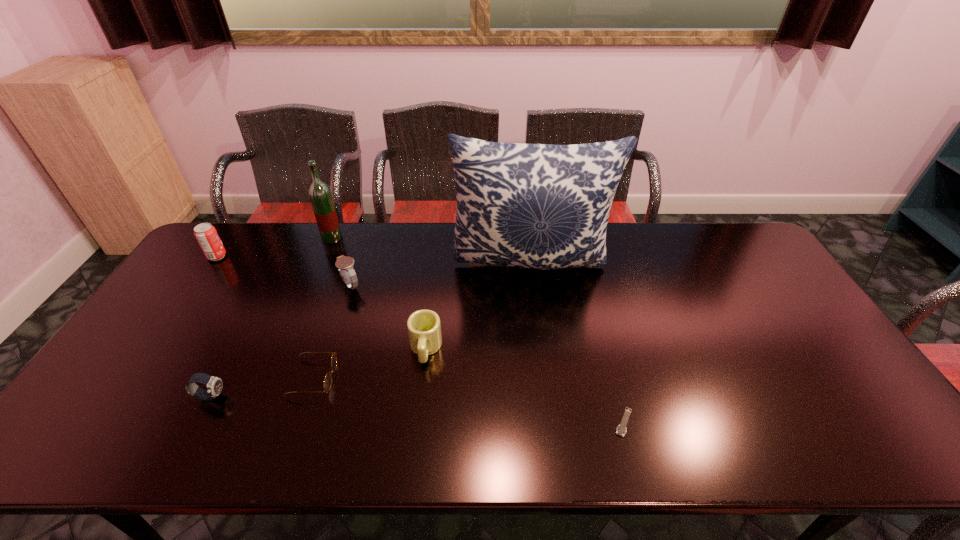
You are a GUI agent. You are given a task and a screenshot of the screen. Output one action in this format:
    pyautogui.click(x=<x>, y=<y>)
    Task: Click on the vacant space that's between the rightmost watch and the tallest object
    
    Given the screenshot: What is the action you would take?
    pyautogui.click(x=577, y=343)

Locate an element on the screen. The width and height of the screenshot is (960, 540). free space that is in between the second tallest watch and the second shortest object is located at coordinates (262, 387).

Locate which object is the fifth closest to the cushion. Please provide its 2D coordinates. Your answer should be formatted as a tuple, i.e. [(x, y)], where the tuple contains the x and y coordinates of a point satisfying the conditions above.

[(319, 192)]

Locate an element on the screen. object that is the closest to the third tallest object is located at coordinates (319, 192).

Where is `watch that is the closest one to the tallest object`? This screenshot has height=540, width=960. watch that is the closest one to the tallest object is located at coordinates (345, 264).

Select which watch is the second closest to the leftmost watch. Please provide its 2D coordinates. Your answer should be formatted as a tuple, i.e. [(x, y)], where the tuple contains the x and y coordinates of a point satisfying the conditions above.

[(621, 430)]

This screenshot has width=960, height=540. What are the coordinates of `free region that satisfies the following two spatial constraints: 1. on the lenses of the seventh tallest object; 2. on the right side of the rightmost watch` in the screenshot? It's located at (300, 422).

This screenshot has height=540, width=960. What are the coordinates of `free point that satisfies the following two spatial constraints: 1. on the lenses of the nearest object; 2. on the right side of the sunglasses` in the screenshot? It's located at (300, 422).

The image size is (960, 540). In order to click on vacant position in the image that satisfies the following two spatial constraints: 1. with the handle on the side of the mug; 2. on the face of the second farthest watch in this screenshot , I will do `click(420, 396)`.

Image resolution: width=960 pixels, height=540 pixels. Find the location of `vacant region that satisfies the following two spatial constraints: 1. on the front surface of the cushion; 2. on the face of the leftmost watch`. vacant region that satisfies the following two spatial constraints: 1. on the front surface of the cushion; 2. on the face of the leftmost watch is located at coordinates (548, 396).